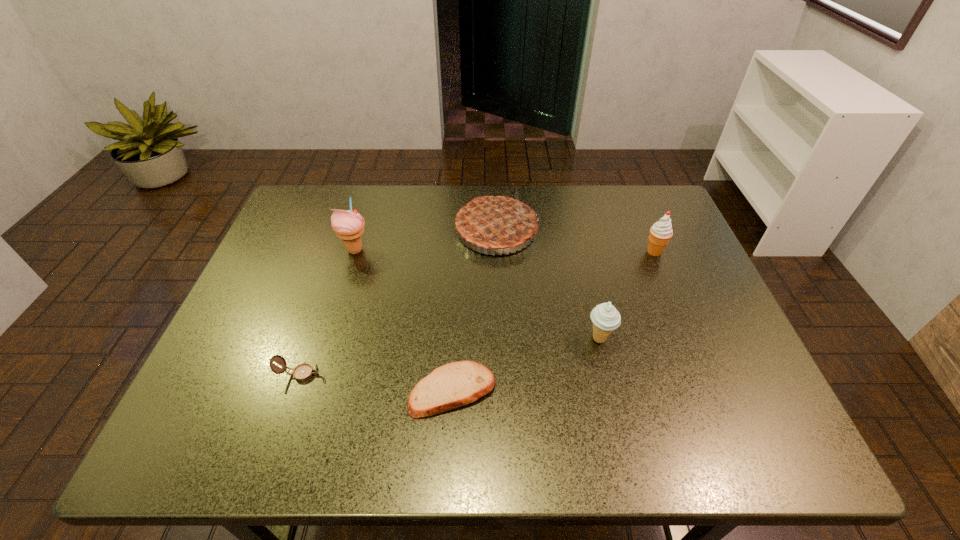
Find the location of a particular element. vacant area at the right edge of the desktop is located at coordinates (642, 262).

At what (x,y) coordinates should I click in order to perform the action: click on free region at the far left corner of the desktop. Please return your answer as a coordinate pair (x, y). Image resolution: width=960 pixels, height=540 pixels. Looking at the image, I should click on (297, 225).

Identify the location of free location at the near left corner of the desktop. (219, 458).

Image resolution: width=960 pixels, height=540 pixels. I want to click on vacant area at the far right corner, so click(x=630, y=199).

Locate an element on the screen. The image size is (960, 540). vacant area at the near right corner is located at coordinates (786, 449).

Identify the location of vacant point located between the second icecream from left to right and the pie. The image size is (960, 540). (548, 285).

You are a GUI agent. You are given a task and a screenshot of the screen. Output one action in this format:
    pyautogui.click(x=<x>, y=<y>)
    Task: Click on the free space between the shortest object and the rightmost icecream
    
    Given the screenshot: What is the action you would take?
    pyautogui.click(x=553, y=321)

Locate an element on the screen. The height and width of the screenshot is (540, 960). free space that is in between the nearest icecream and the rightmost object is located at coordinates (627, 295).

Image resolution: width=960 pixels, height=540 pixels. I want to click on free space that is in between the leftmost icecream and the pita bread, so click(x=404, y=320).

You are a GUI agent. You are given a task and a screenshot of the screen. Output one action in this format:
    pyautogui.click(x=<x>, y=<y>)
    Task: Click on the free spot between the second shortest object and the leftmost icecream
    
    Given the screenshot: What is the action you would take?
    pyautogui.click(x=327, y=312)